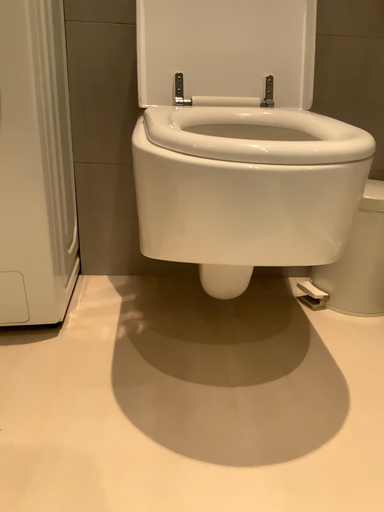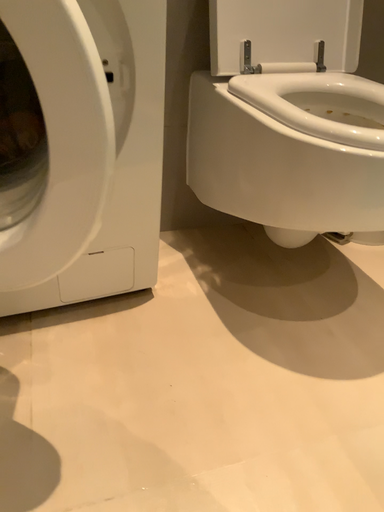
Question: How did the camera likely rotate when shooting the video?

Choices:
 (A) rotated downward
 (B) rotated upward

Answer: (A)